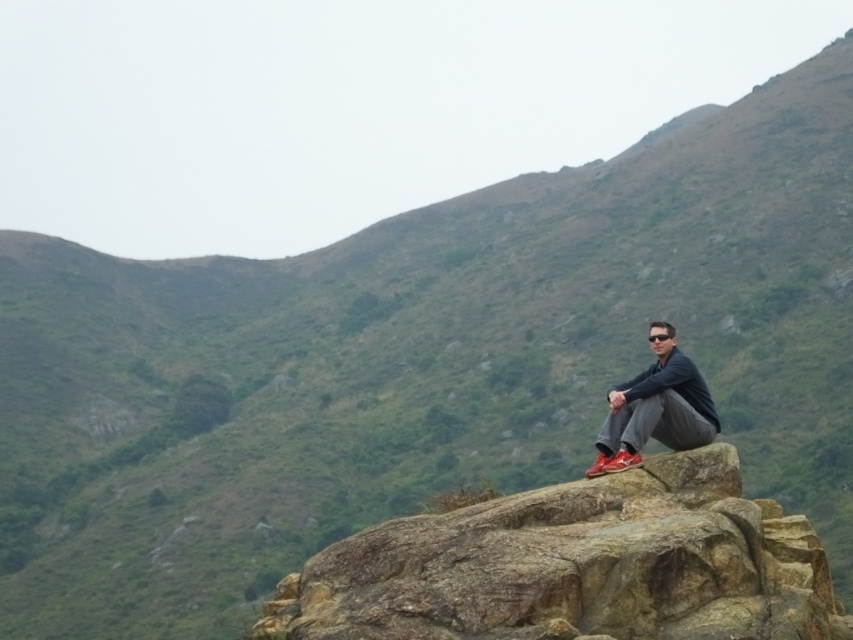
Question: Is the position of brown rough rock at center more distant than that of matte black jacket at center?

Choices:
 (A) no
 (B) yes

Answer: (A)

Question: Which point is farther to the camera?

Choices:
 (A) brown rough rock at center
 (B) matte black jacket at center

Answer: (B)

Question: Which point is closer to the camera?

Choices:
 (A) matte black jacket at center
 (B) brown rough rock at center

Answer: (B)

Question: Where is brown rough rock at center located in relation to matte black jacket at center in the image?

Choices:
 (A) above
 (B) below

Answer: (B)

Question: Which object appears farthest from the camera in this image?

Choices:
 (A) brown rough rock at center
 (B) matte black jacket at center

Answer: (B)

Question: Is brown rough rock at center positioned behind matte black jacket at center?

Choices:
 (A) no
 (B) yes

Answer: (A)